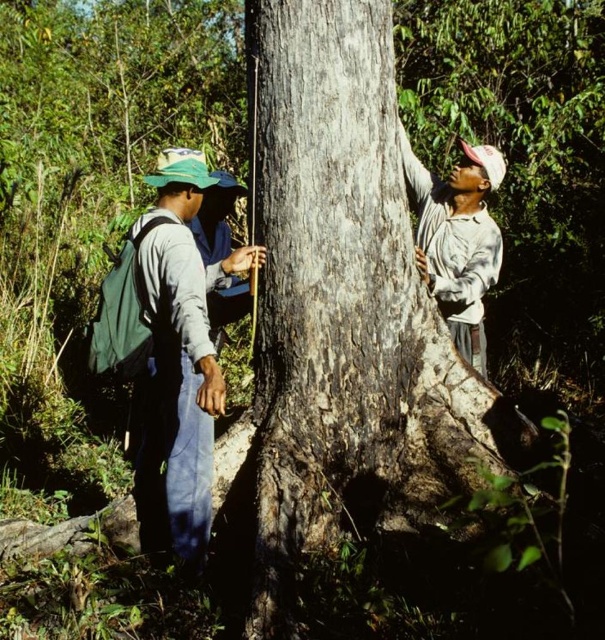
Question: Among these objects, which one is farthest from the camera?

Choices:
 (A) dark brown rough bark at center
 (B) green canvas backpack at left
 (C) green fabric shirt at center
 (D) white matte shirt at upper right

Answer: (C)

Question: Is green canvas backpack at left wider than green fabric shirt at center?

Choices:
 (A) no
 (B) yes

Answer: (B)

Question: Which of the following is the farthest from the observer?

Choices:
 (A) (214, 259)
 (B) (157, 284)
 (C) (468, 252)
 (D) (249, 35)

Answer: (A)

Question: Does white matte shirt at upper right have a lesser width compared to green fabric shirt at center?

Choices:
 (A) yes
 (B) no

Answer: (B)

Question: Is dark brown rough bark at center below white matte shirt at upper right?

Choices:
 (A) yes
 (B) no

Answer: (A)

Question: Which of the following is the closest to the observer?

Choices:
 (A) dark brown rough bark at center
 (B) white matte shirt at upper right
 (C) green canvas backpack at left
 (D) green fabric shirt at center

Answer: (C)